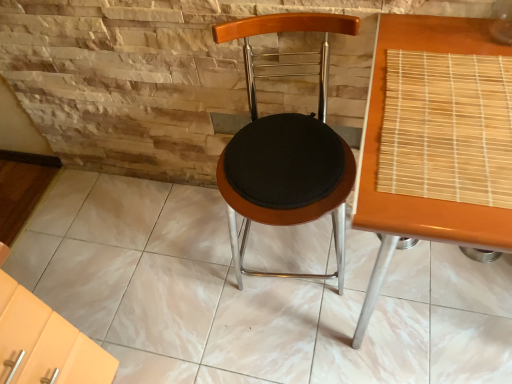
Image resolution: width=512 pixels, height=384 pixels. In order to click on empty space that is in between woodenseat cushion at center and wooden bamboo mat at right in this screenshot , I will do `click(303, 319)`.